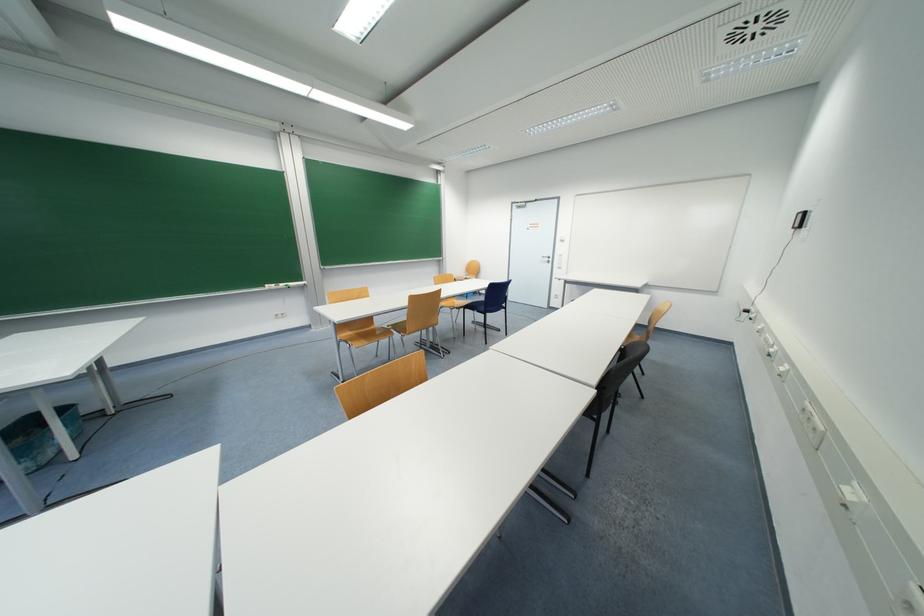
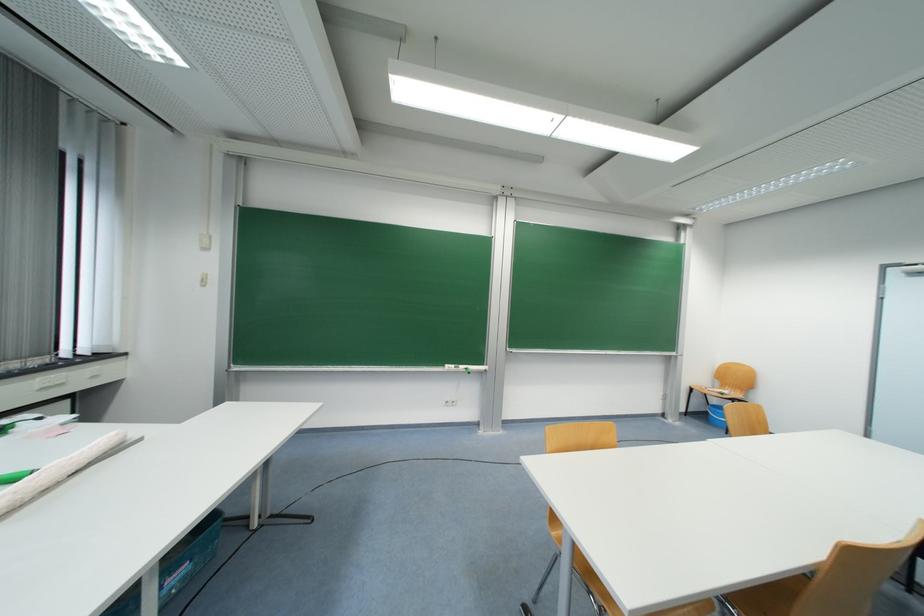
Locate, in the second image, the point that corresponds to (285,318) in the first image.

(455, 406)